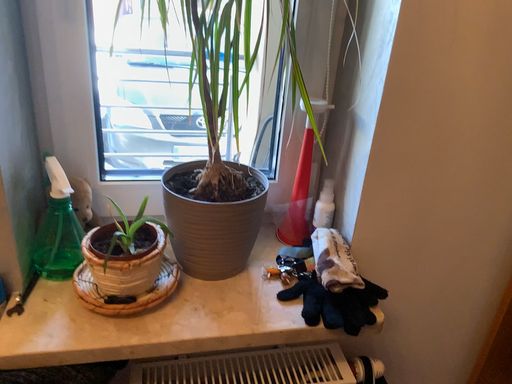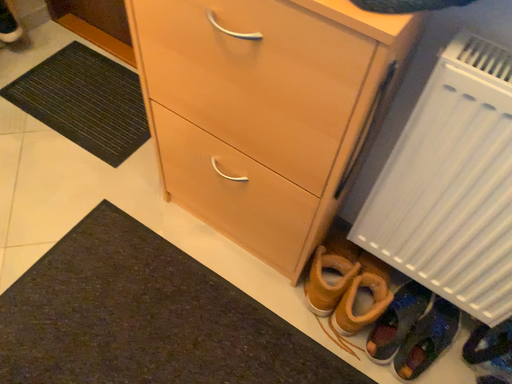
Question: Which way did the camera rotate in the video?

Choices:
 (A) rotated upward
 (B) rotated downward

Answer: (B)